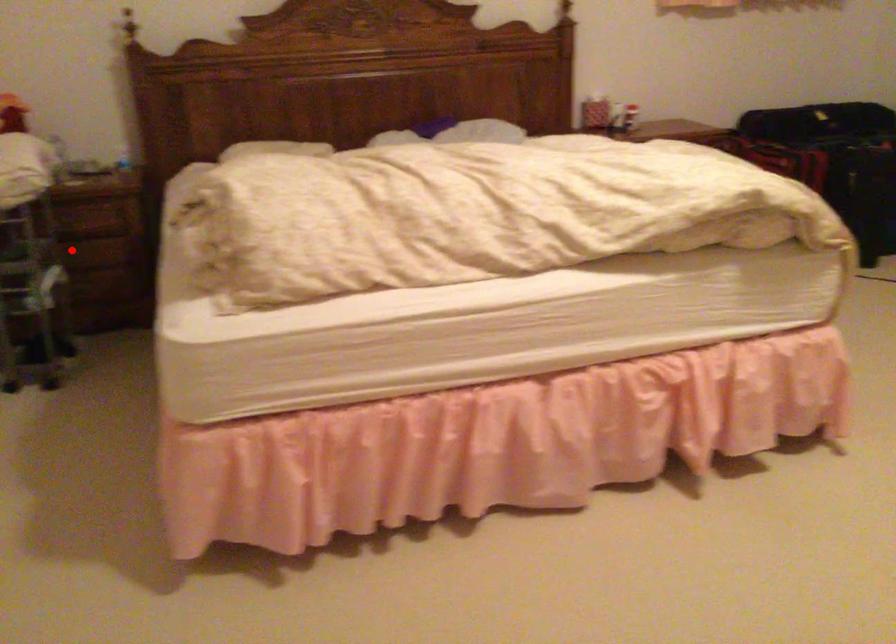
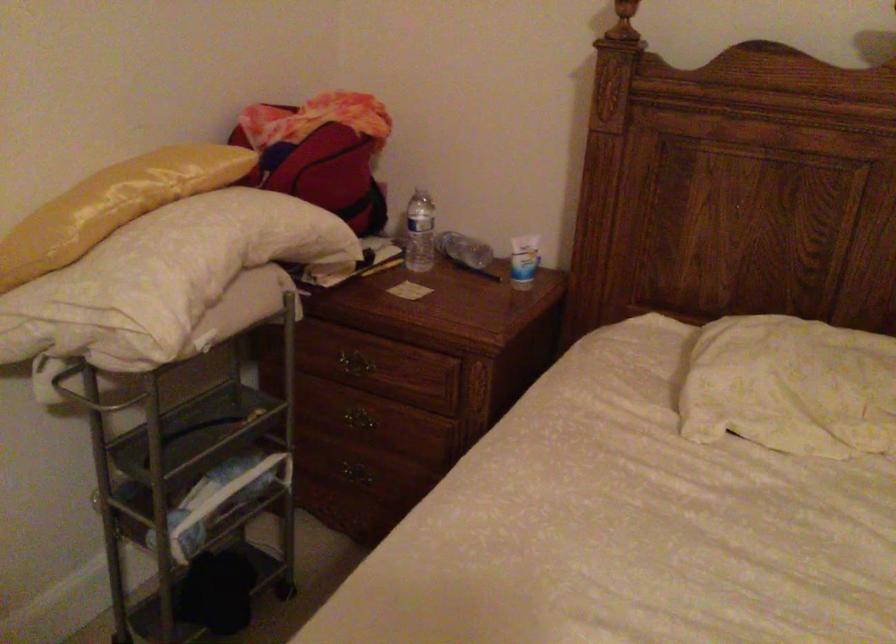
Question: I am providing you with two images of the same scene from different viewpoints. Image1 has a red point marked. In image2, the corresponding 3D location appears at what relative position? Reply with the corresponding letter.

Choices:
 (A) Closer
 (B) Farther

Answer: (A)